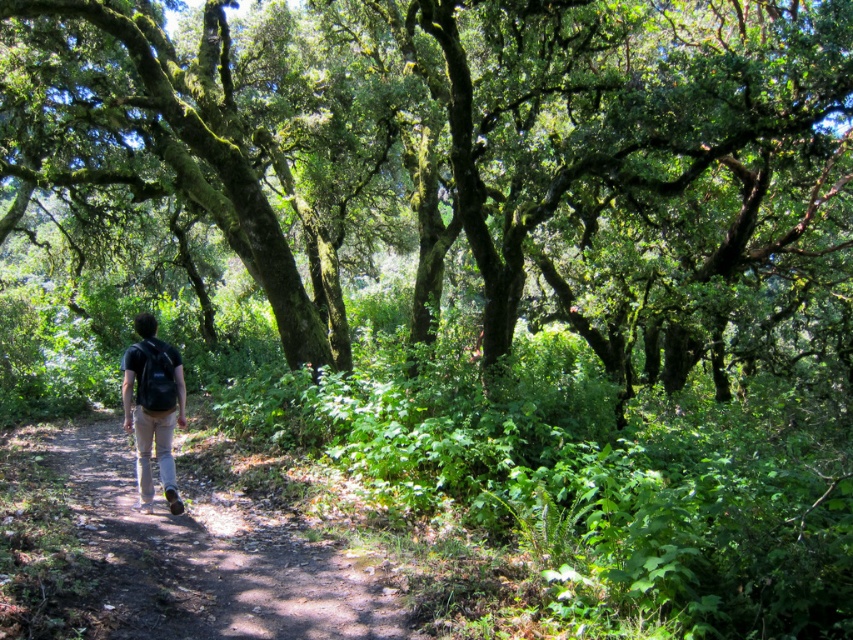
Who is shorter, green mossy tree at center or matte black backpack at center?

matte black backpack at center is shorter.

Locate an element on the screen. green mossy tree at center is located at coordinates (x=445, y=156).

Can you confirm if green mossy tree at center is taller than brown dirt path at center?

Correct, green mossy tree at center is much taller as brown dirt path at center.

Measure the distance between point (805, 224) and camera.

A distance of 13.82 meters exists between point (805, 224) and camera.

I want to click on green mossy tree at center, so click(445, 156).

Does brown dirt path at center appear on the left side of matte black backpack at center?

No, brown dirt path at center is not to the left of matte black backpack at center.

This screenshot has height=640, width=853. In order to click on brown dirt path at center in this screenshot , I will do `click(212, 556)`.